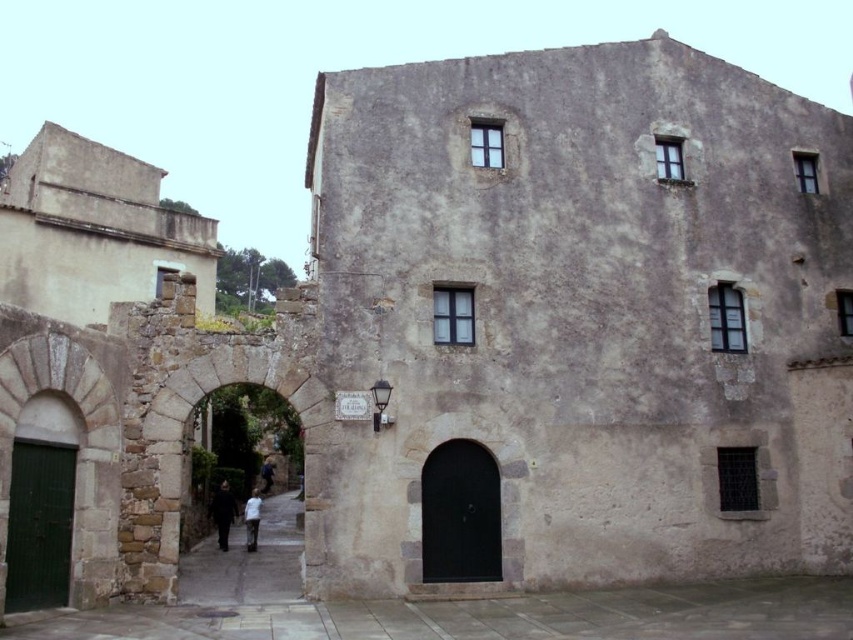
Is white cotton shirt at center further to the viewer compared to dark blue jeans at center?

No, it is in front of dark blue jeans at center.

Between white cotton shirt at center and dark blue jeans at center, which one has more height?

white cotton shirt at center

Identify the location of white cotton shirt at center. The image size is (853, 640). (252, 518).

Is dark gray stone alley at center above black matte coat at center?

No.

Does point (248, 573) lie behind point (218, 486)?

No, it is in front of (218, 486).

The height and width of the screenshot is (640, 853). What do you see at coordinates (247, 561) in the screenshot?
I see `dark gray stone alley at center` at bounding box center [247, 561].

I want to click on dark gray stone alley at center, so click(x=247, y=561).

Can you confirm if dark gray stone alley at center is bigger than white cotton shirt at center?

Yes, dark gray stone alley at center is bigger than white cotton shirt at center.

This screenshot has width=853, height=640. Describe the element at coordinates (247, 561) in the screenshot. I see `dark gray stone alley at center` at that location.

This screenshot has height=640, width=853. Describe the element at coordinates (247, 561) in the screenshot. I see `dark gray stone alley at center` at that location.

Identify the location of dark gray stone alley at center. The width and height of the screenshot is (853, 640). (247, 561).